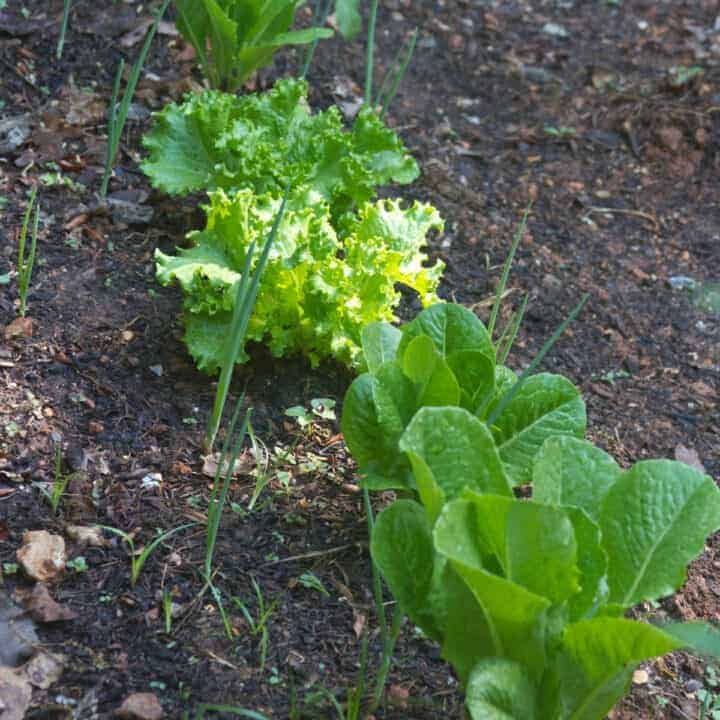
At what (x,y) coordinates should I click in order to perform the action: click on tiny plants. Please return your answer as a coordinate pair (x, y). This screenshot has height=720, width=720. Looking at the image, I should click on (558, 132), (310, 582), (714, 701), (706, 679), (75, 564), (6, 567), (14, 428), (618, 368).